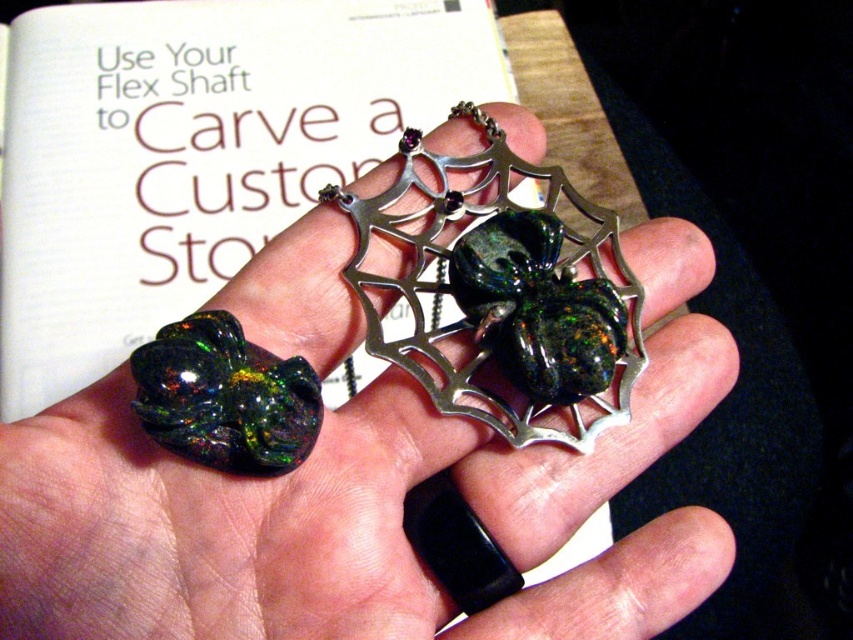
Question: Which object is positioned farthest from the shiny silver spider at center?

Choices:
 (A) opalescent stone insect at center
 (B) white paper book at upper center
 (C) green opal spider at center
 (D) green opal ring at center

Answer: (B)

Question: Can you confirm if green opal ring at center is thinner than green opal spider at center?

Choices:
 (A) no
 (B) yes

Answer: (A)

Question: Based on their relative distances, which object is nearer to the white paper book at upper center?

Choices:
 (A) shiny silver spider at center
 (B) green opal ring at center
 (C) opalescent stone insect at center
 (D) green opal spider at center

Answer: (A)

Question: Is the position of white paper book at upper center less distant than that of opalescent stone insect at center?

Choices:
 (A) yes
 (B) no

Answer: (B)

Question: Which object is closer to the camera taking this photo?

Choices:
 (A) white paper book at upper center
 (B) opalescent stone insect at center
 (C) green opal spider at center

Answer: (B)

Question: Is green opal spider at center above opalescent stone insect at center?

Choices:
 (A) no
 (B) yes

Answer: (B)